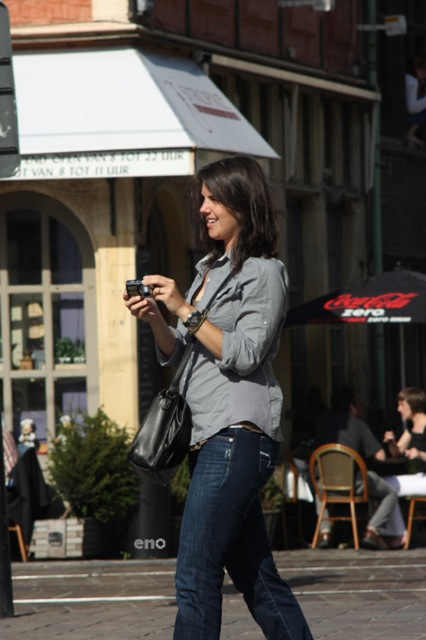
Can you confirm if matte gray shirt at center is shorter than dark blue denim jeans at lower center?

No.

Is matte gray shirt at center smaller than dark blue denim jeans at lower center?

Actually, matte gray shirt at center might be larger than dark blue denim jeans at lower center.

What do you see at coordinates (227, 401) in the screenshot? This screenshot has width=426, height=640. I see `matte gray shirt at center` at bounding box center [227, 401].

The image size is (426, 640). Identify the location of matte gray shirt at center. (227, 401).

In the scene shown: Is matte gray shirt at center below blue denim jeans at lower center?

Incorrect, matte gray shirt at center is not positioned below blue denim jeans at lower center.

Who is more distant from viewer, (x=255, y=193) or (x=80, y=637)?

The point (x=80, y=637) is behind.

Find the location of a particular element. The image size is (426, 640). matte gray shirt at center is located at coordinates (227, 401).

Who is more distant from viewer, (141,634) or (299,620)?

Point (141,634)

Is blue denim jeans at lower center positioned at the back of dark blue denim jeans at lower center?

Yes.

Is point (157, 616) less distant than point (189, 609)?

No, (157, 616) is behind (189, 609).

At what (x,y) coordinates should I click in order to perform the action: click on blue denim jeans at lower center. Please return your answer as a coordinate pair (x, y). Looking at the image, I should click on (92, 600).